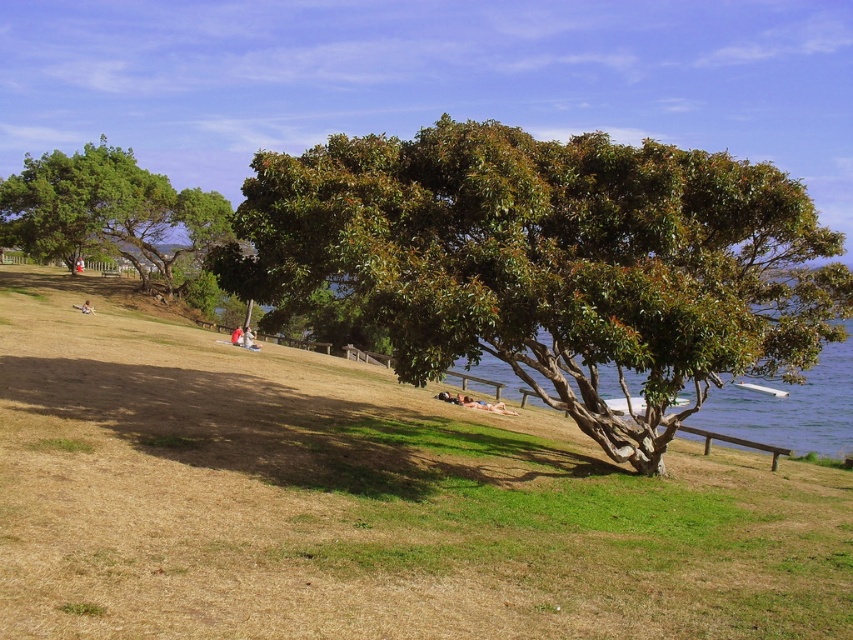
Question: Which point is farther from the camera taking this photo?

Choices:
 (A) (276, 288)
 (B) (752, 380)

Answer: (B)

Question: Is green glossy tree at center bigger than green leafy tree at upper left?

Choices:
 (A) yes
 (B) no

Answer: (B)

Question: Can you confirm if green glossy tree at center is positioned to the right of clear blue water at lower right?

Choices:
 (A) no
 (B) yes

Answer: (A)

Question: Does green leafy tree at upper left appear over clear blue water at lower right?

Choices:
 (A) no
 (B) yes

Answer: (B)

Question: Which object is the closest to the green leafy tree at upper left?

Choices:
 (A) clear blue water at lower right
 (B) green glossy tree at center

Answer: (B)

Question: Which of the following is the closest to the observer?

Choices:
 (A) green leafy tree at upper left
 (B) green glossy tree at center
 (C) clear blue water at lower right

Answer: (B)